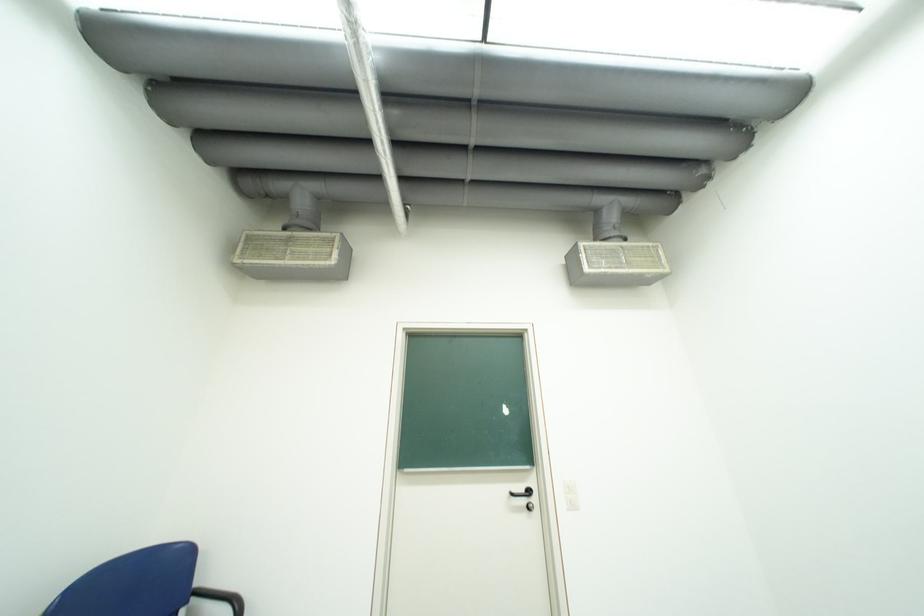
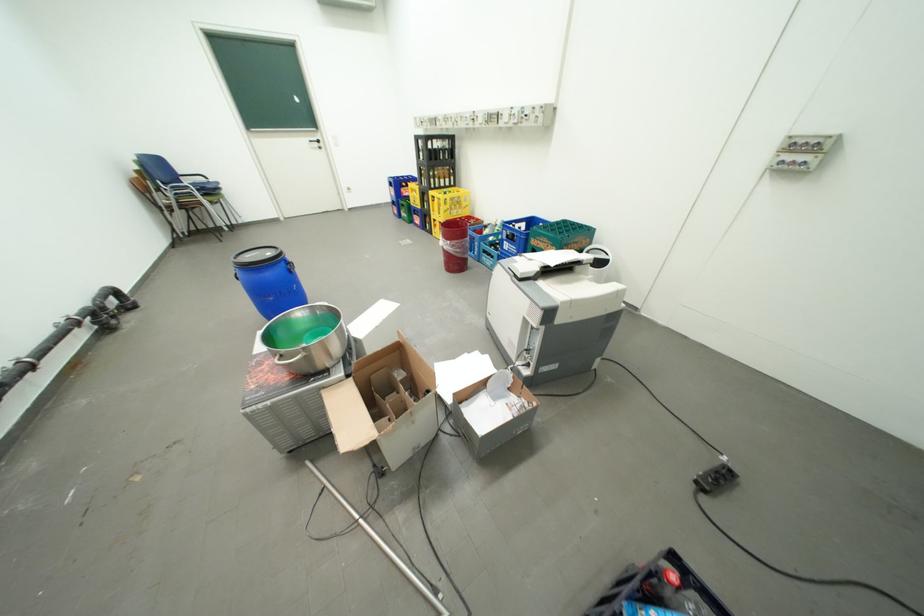
Find the pixel in the second image that matches point (518, 495) in the first image.

(320, 143)